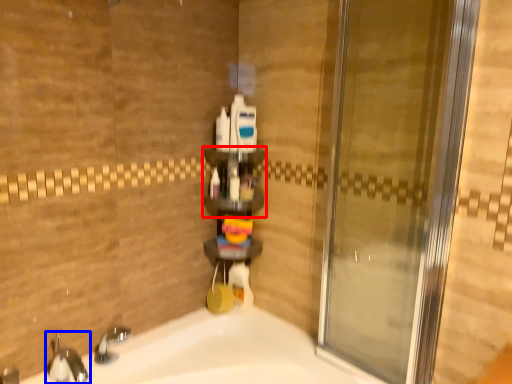
Question: Which object appears farthest to the camera in this image, shelf (highlighted by a red box) or tap (highlighted by a blue box)?

Choices:
 (A) shelf
 (B) tap

Answer: (A)